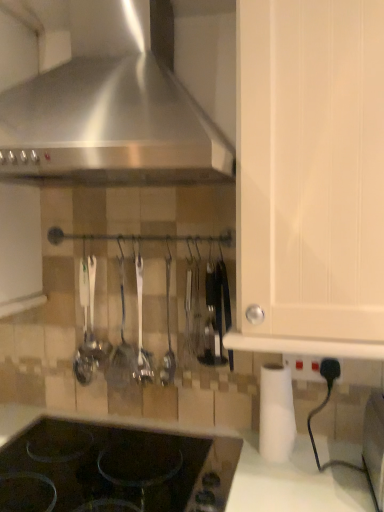
Question: Considering the relative sizes of white matte paper towel at lower right and stainless steel range hood at upper left in the image provided, is white matte paper towel at lower right wider than stainless steel range hood at upper left?

Choices:
 (A) no
 (B) yes

Answer: (A)

Question: Is white matte paper towel at lower right oriented towards stainless steel range hood at upper left?

Choices:
 (A) yes
 (B) no

Answer: (B)

Question: Can you confirm if white matte paper towel at lower right is positioned to the left of stainless steel range hood at upper left?

Choices:
 (A) yes
 (B) no

Answer: (B)

Question: From a real-world perspective, is white matte paper towel at lower right on top of stainless steel range hood at upper left?

Choices:
 (A) yes
 (B) no

Answer: (B)

Question: Is white matte paper towel at lower right in front of stainless steel range hood at upper left?

Choices:
 (A) no
 (B) yes

Answer: (A)

Question: Is silver polished spoon at center, the 1th silverware from the right, taller or shorter than polished metal spoon at center, which is the second silverware in right-to-left order?

Choices:
 (A) short
 (B) tall

Answer: (B)

Question: From the image's perspective, is silver polished spoon at center, the 1th silverware from the right, above or below polished metal spoon at center, which is the second silverware in right-to-left order?

Choices:
 (A) below
 (B) above

Answer: (A)

Question: Is point (140, 302) positioned closer to the camera than point (120, 321)?

Choices:
 (A) farther
 (B) closer

Answer: (B)

Question: In terms of size, does silver polished spoon at center, the 1th silverware from the right, appear bigger or smaller than polished metal spoon at center, which ranks as the 1th silverware in left-to-right order?

Choices:
 (A) small
 (B) big

Answer: (B)

Question: From a real-world perspective, is white matte paper towel at lower right physically located above or below white matte cabinet door at center-right?

Choices:
 (A) above
 (B) below

Answer: (B)

Question: Considering the positions of white matte paper towel at lower right and white matte cabinet door at center-right in the image, is white matte paper towel at lower right wider or thinner than white matte cabinet door at center-right?

Choices:
 (A) thin
 (B) wide

Answer: (A)

Question: Visually, is white matte paper towel at lower right positioned to the left or to the right of white matte cabinet door at center-right?

Choices:
 (A) left
 (B) right

Answer: (A)

Question: Looking at the image, does white matte paper towel at lower right seem bigger or smaller compared to white matte cabinet door at center-right?

Choices:
 (A) small
 (B) big

Answer: (A)

Question: Looking at their shapes, would you say white matte paper towel at lower right is wider or thinner than black plastic knife at center?

Choices:
 (A) thin
 (B) wide

Answer: (A)

Question: Is white matte paper towel at lower right in front of or behind black plastic knife at center in the image?

Choices:
 (A) behind
 (B) front

Answer: (B)